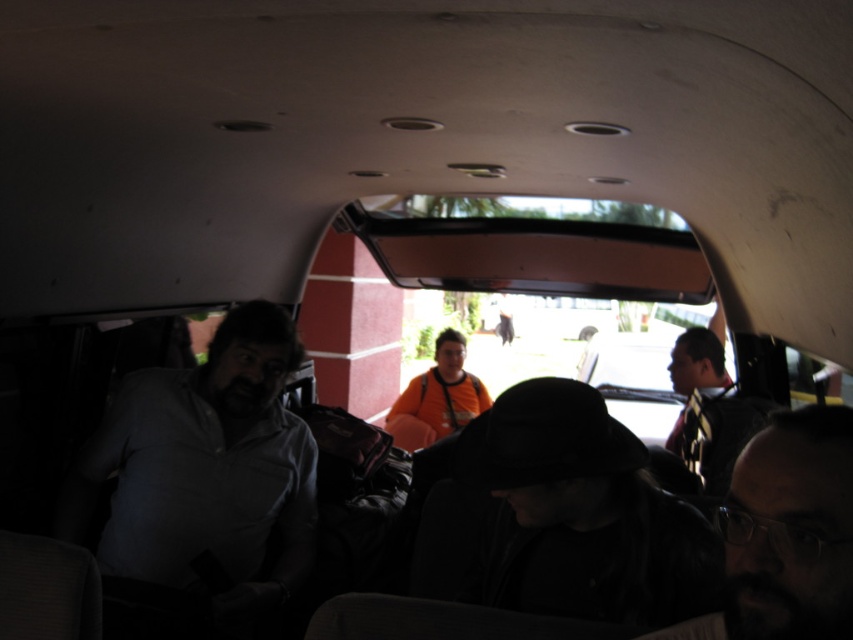
Question: Considering the relative positions of matte gray shirt at left and dark hair at lower right in the image provided, where is matte gray shirt at left located with respect to dark hair at lower right?

Choices:
 (A) above
 (B) below

Answer: (B)

Question: Is matte gray shirt at left below dark hair at lower right?

Choices:
 (A) yes
 (B) no

Answer: (A)

Question: Does matte gray shirt at left appear on the left side of dark hair at lower right?

Choices:
 (A) yes
 (B) no

Answer: (A)

Question: Which of the following is the farthest from the observer?

Choices:
 (A) matte gray shirt at left
 (B) dark hair at lower right

Answer: (A)